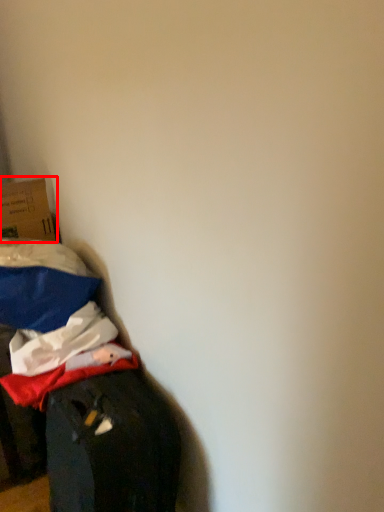
Question: From the image, what is the correct spatial relationship of box (annotated by the red box) in relation to furniture?

Choices:
 (A) left
 (B) right

Answer: (A)